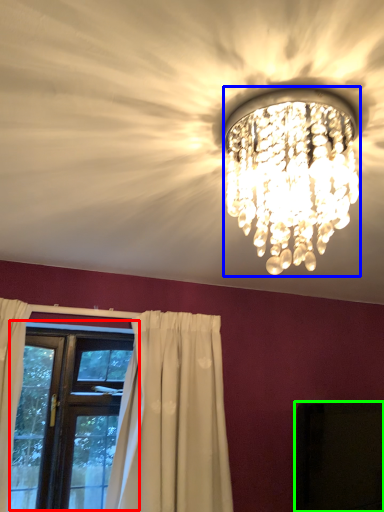
Question: Estimate the real-world distances between objects in this image. Which object is closer to window (highlighted by a red box), lamp (highlighted by a blue box) or dark (highlighted by a green box)?

Choices:
 (A) lamp
 (B) dark

Answer: (B)